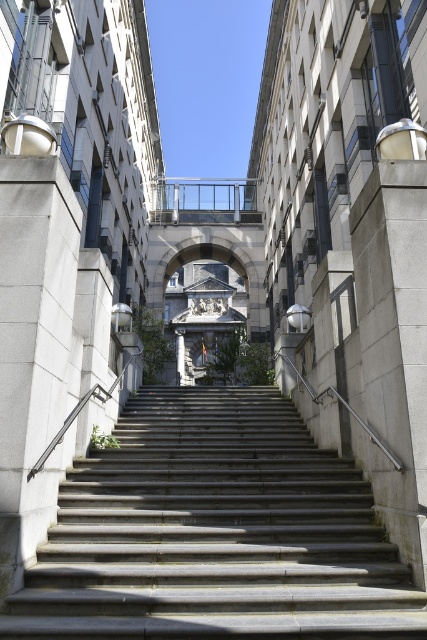
You are standing at the base of the gray concrete stairs at center. To reach the top of the stairs, in which direction should you move?

You should move upward along the gray concrete stairs at center to reach the top since the stairs ascend in that direction.

You are a delivery person carrying a large box that is 2 meters wide. You need to navigate through the gray concrete stairs at center and the clear glass balustrade at upper center. Which path should you choose to ensure your box fits through?

The gray concrete stairs at center has a greater width than the clear glass balustrade at upper center, so you should choose the gray concrete stairs at center path to fit your 2 meter wide box.

You are an architect designing a new building and want to ensure the gray concrete stairs at center are visible from above. Considering the clear glass balustrade at upper center, will the stairs be obscured by the balustrade?

The gray concrete stairs at center is bigger than clear glass balustrade at upper center, so the stairs will not be fully obscured by the balustrade as the stairs are larger in size.